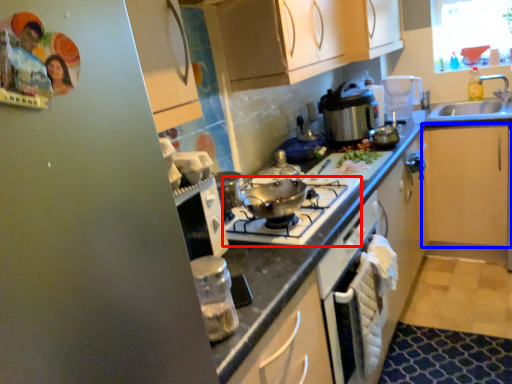
Question: Which of the following is the farthest to the observer, gas stove (highlighted by a red box) or cabinetry (highlighted by a blue box)?

Choices:
 (A) gas stove
 (B) cabinetry

Answer: (B)